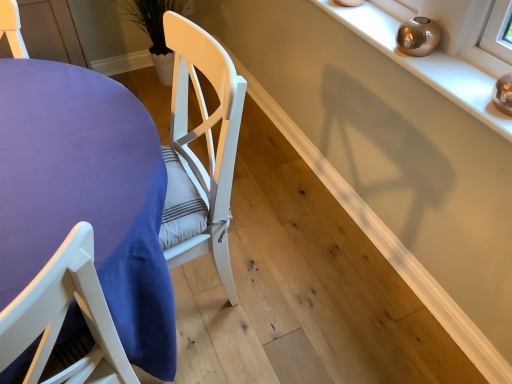
Describe the element at coordinates (86, 195) in the screenshot. I see `purple fabric table at lower left` at that location.

You are a GUI agent. You are given a task and a screenshot of the screen. Output one action in this format:
    pyautogui.click(x=<x>, y=<y>)
    Task: Click on the purple fabric table at lower left
    
    Given the screenshot: What is the action you would take?
    pyautogui.click(x=86, y=195)

In order to click on metallic gold orb at upper right in this screenshot , I will do `click(426, 65)`.

What do you see at coordinates (426, 65) in the screenshot? The image size is (512, 384). I see `metallic gold orb at upper right` at bounding box center [426, 65].

Locate an element on the screen. This screenshot has height=384, width=512. purple fabric table at lower left is located at coordinates (86, 195).

Between metallic gold orb at upper right and purple fabric table at lower left, which one appears on the right side from the viewer's perspective?

Positioned to the right is metallic gold orb at upper right.

Which is behind, metallic gold orb at upper right or purple fabric table at lower left?

metallic gold orb at upper right is further away from the camera.

Considering the positions of points (374, 37) and (3, 161), is point (374, 37) farther from camera compared to point (3, 161)?

Yes, it is behind point (3, 161).

From the image's perspective, is metallic gold orb at upper right under purple fabric table at lower left?

No, from the image's perspective, metallic gold orb at upper right is not beneath purple fabric table at lower left.

From a real-world perspective, is metallic gold orb at upper right above or below purple fabric table at lower left?

From a real-world perspective, metallic gold orb at upper right is physically above purple fabric table at lower left.

Which object is thinner, metallic gold orb at upper right or purple fabric table at lower left?

Thinner between the two is metallic gold orb at upper right.

Between metallic gold orb at upper right and purple fabric table at lower left, which one has less height?

Standing shorter between the two is metallic gold orb at upper right.

Between metallic gold orb at upper right and purple fabric table at lower left, which one has smaller size?

With smaller size is metallic gold orb at upper right.

Is metallic gold orb at upper right located outside purple fabric table at lower left?

Indeed, metallic gold orb at upper right is completely outside purple fabric table at lower left.

Is metallic gold orb at upper right far away from purple fabric table at lower left?

Actually, metallic gold orb at upper right and purple fabric table at lower left are a little close together.

Is purple fabric table at lower left at the back of metallic gold orb at upper right?

No, purple fabric table at lower left is not at the back of metallic gold orb at upper right.

Can you tell me how much metallic gold orb at upper right and purple fabric table at lower left differ in facing direction?

The angular difference between metallic gold orb at upper right and purple fabric table at lower left is 68.7 degrees.

How distant is metallic gold orb at upper right from purple fabric table at lower left?

metallic gold orb at upper right and purple fabric table at lower left are 91.10 centimeters apart.

At what (x,y) coordinates should I click in order to perform the action: click on table lying below the metallic gold orb at upper right (from the image's perspective). Please return your answer as a coordinate pair (x, y). Looking at the image, I should click on (86, 195).

Does purple fabric table at lower left appear on the right side of metallic gold orb at upper right?

In fact, purple fabric table at lower left is to the left of metallic gold orb at upper right.

Which object is further away from the camera, purple fabric table at lower left or metallic gold orb at upper right?

metallic gold orb at upper right is further from the camera.

Which is in front, point (90, 200) or point (472, 97)?

The point (90, 200) is in front.

From the image's perspective, who appears lower, purple fabric table at lower left or metallic gold orb at upper right?

purple fabric table at lower left appears lower in the image.

From a real-world perspective, which object rests below the other?

In real-world perspective, purple fabric table at lower left is lower.

Considering the sizes of purple fabric table at lower left and metallic gold orb at upper right in the image, is purple fabric table at lower left wider or thinner than metallic gold orb at upper right?

In the image, purple fabric table at lower left appears to be wider than metallic gold orb at upper right.

Considering the sizes of objects purple fabric table at lower left and metallic gold orb at upper right in the image provided, who is taller, purple fabric table at lower left or metallic gold orb at upper right?

purple fabric table at lower left.

Looking at the image, does purple fabric table at lower left seem bigger or smaller compared to metallic gold orb at upper right?

Clearly, purple fabric table at lower left is larger in size than metallic gold orb at upper right.

Is purple fabric table at lower left located outside metallic gold orb at upper right?

Indeed, purple fabric table at lower left is completely outside metallic gold orb at upper right.

Are purple fabric table at lower left and metallic gold orb at upper right located far from each other?

That's not correct — purple fabric table at lower left is a little close to metallic gold orb at upper right.

Is purple fabric table at lower left positioned with its back to metallic gold orb at upper right?

No, purple fabric table at lower left is not facing the opposite direction of metallic gold orb at upper right.

How far apart are purple fabric table at lower left and metallic gold orb at upper right?

The distance of purple fabric table at lower left from metallic gold orb at upper right is 35.87 inches.

Where is `table on the left of metallic gold orb at upper right`? table on the left of metallic gold orb at upper right is located at coordinates (86, 195).

There is a purple fabric table at lower left. Where is `shelf above it (from a real-world perspective)`? shelf above it (from a real-world perspective) is located at coordinates (426, 65).

Locate an element on the screen. shelf that is on the right side of purple fabric table at lower left is located at coordinates (426, 65).